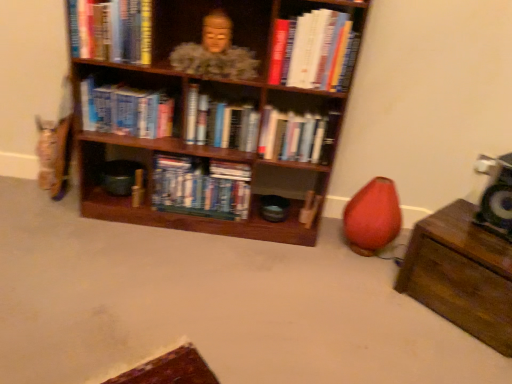
Question: From a real-world perspective, is hardcover book at upper right, which appears as the 1th book when viewed from the right, positioned above or below matte pink bean bag chair at lower right?

Choices:
 (A) above
 (B) below

Answer: (A)

Question: Does point (349, 52) appear closer or farther from the camera than point (396, 193)?

Choices:
 (A) farther
 (B) closer

Answer: (B)

Question: Estimate the real-world distances between objects in this image. Which object is farther from the brown wooden chest at lower right?

Choices:
 (A) green fabric speaker at right
 (B) matte gold statue at upper center
 (C) hardcover books at center, placed as the 1th book when sorted from left to right
 (D) hardcover books at center, which is counted as the second book, starting from the right
 (E) hardcover book at upper right, which is counted as the sixth book, starting from the left

Answer: (C)

Question: Which object is the closest to the matte gold statue at upper center?

Choices:
 (A) hardcover books at center, the sixth book positioned from the right
 (B) hardcover books at center, which is the 3th book from right to left
 (C) brown wooden chest at lower right
 (D) matte pink bean bag chair at lower right
 (E) hardcover books at center, the fifth book when ordered from left to right

Answer: (B)